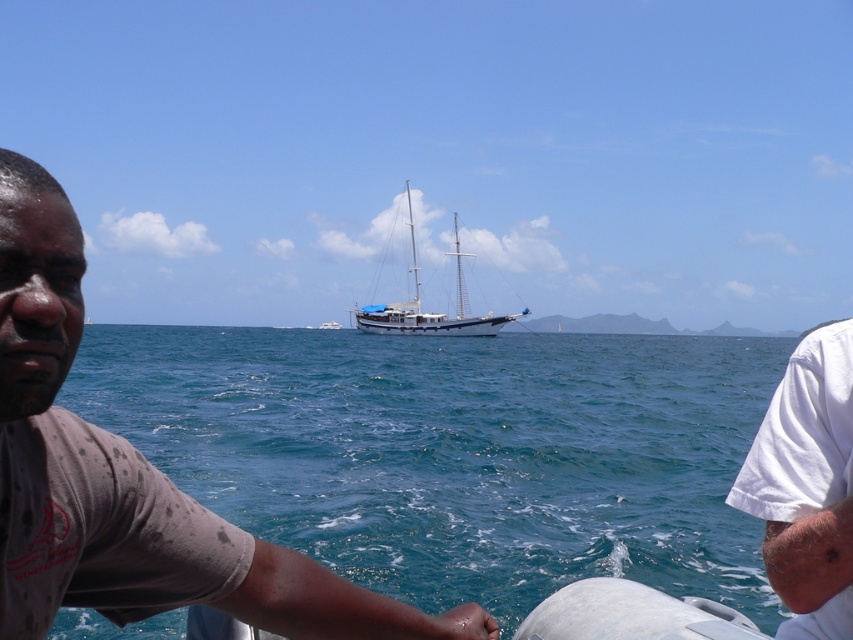
Question: Does blue water at center have a smaller size compared to brown cotton shirt at left?

Choices:
 (A) no
 (B) yes

Answer: (A)

Question: Does white cotton shirt at right have a lesser width compared to blue matte sailboat at center?

Choices:
 (A) no
 (B) yes

Answer: (B)

Question: Which object appears closest to the camera in this image?

Choices:
 (A) white cotton shirt at right
 (B) blue matte sailboat at center
 (C) brown cotton shirt at left

Answer: (C)

Question: Which of the following is the farthest from the observer?

Choices:
 (A) (44, 589)
 (B) (830, 586)
 (C) (408, 324)

Answer: (C)

Question: Estimate the real-world distances between objects in this image. Which object is closer to the white cotton shirt at right?

Choices:
 (A) brown cotton shirt at left
 (B) blue water at center
 (C) blue matte sailboat at center

Answer: (A)

Question: Can you confirm if white cotton shirt at right is positioned below blue matte sailboat at center?

Choices:
 (A) yes
 (B) no

Answer: (A)